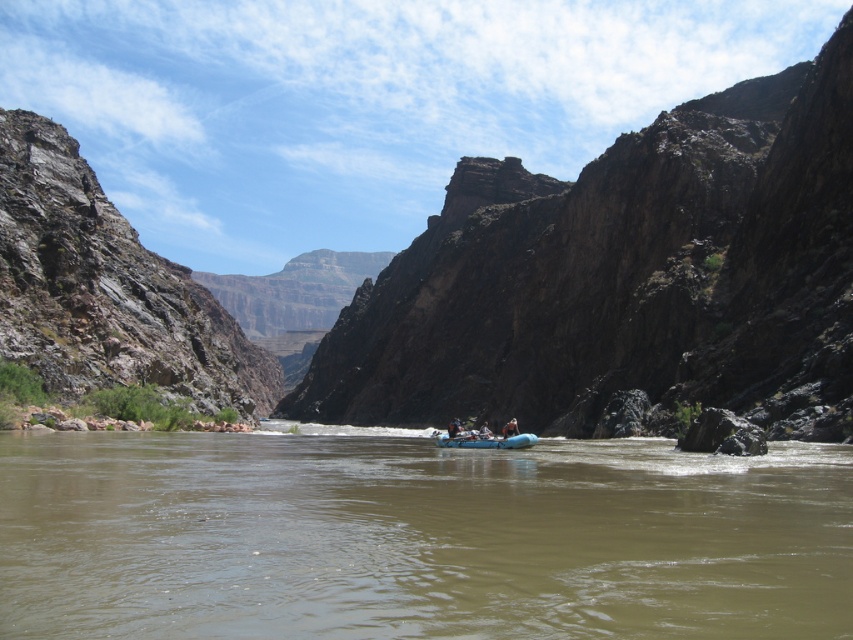
Can you confirm if brown rocky canyon at center is smaller than blue rubber raft at center?

No.

Which of these two, brown rocky canyon at center or blue rubber raft at center, stands taller?

brown rocky canyon at center

Which is behind, point (711, 116) or point (537, 436)?

The point (711, 116) is more distant.

Locate an element on the screen. This screenshot has height=640, width=853. brown rocky canyon at center is located at coordinates (625, 276).

Looking at this image, which of these two, brown rubber raft at center or blue fabric raft at center, stands shorter?

brown rubber raft at center is shorter.

Is point (306, 532) closer to camera compared to point (506, 424)?

Yes, point (306, 532) is in front of point (506, 424).

Find the location of a particular element. brown rubber raft at center is located at coordinates (418, 538).

Find the location of a particular element. Image resolution: width=853 pixels, height=640 pixels. brown rubber raft at center is located at coordinates (418, 538).

Does brown rubber raft at center have a larger size compared to blue rubber raft at center?

Correct, brown rubber raft at center is larger in size than blue rubber raft at center.

Identify the location of brown rubber raft at center. (418, 538).